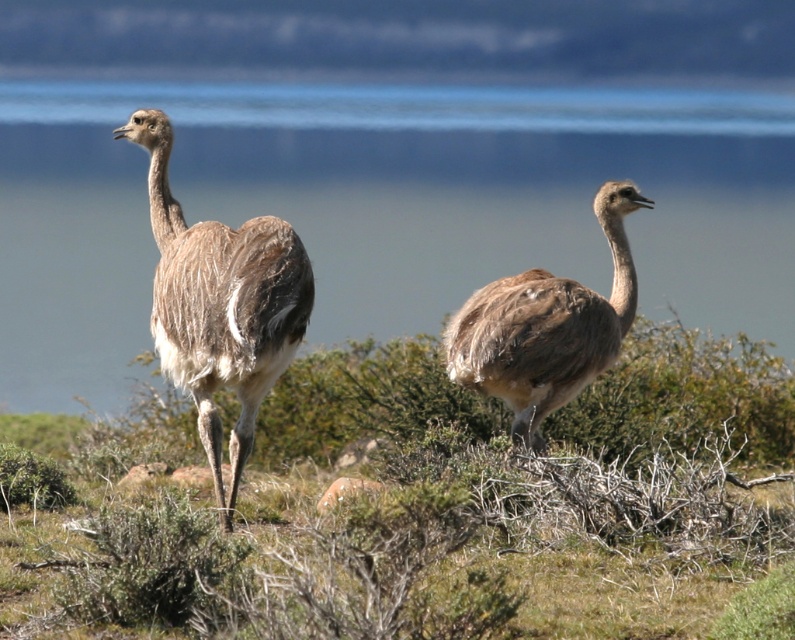
You are a wildlife photographer aiming to capture a photo of both brown feathered ostrich at left and brown feathered ostrich at center. Since you want to ensure both are in focus, which one should you focus on first to maintain depth of field?

The brown feathered ostrich at left is located above the brown feathered ostrich at center, so focusing on the one at left first would help maintain depth of field as it is closer to the camera.

You are a photographer trying to capture a close shot of the rhea birds in the scene. You have a camera with a 100mm lens that can focus on objects up to 20 feet away. There is a point marked at coordinates point (220, 433) that you need to consider. Can you focus on this point with your current lens setting?

The point (220, 433) is 16.62 feet from the camera. Since the lens can focus up to 20 feet, the camera can focus on the point (220, 433).

You are a photographer trying to capture the blue water at center and the brown feathered ostrich at left in a single frame. Which object will occupy more space in your photo?

The blue water at center will occupy more space in the photo because it is bigger than the brown feathered ostrich at left according to the description.